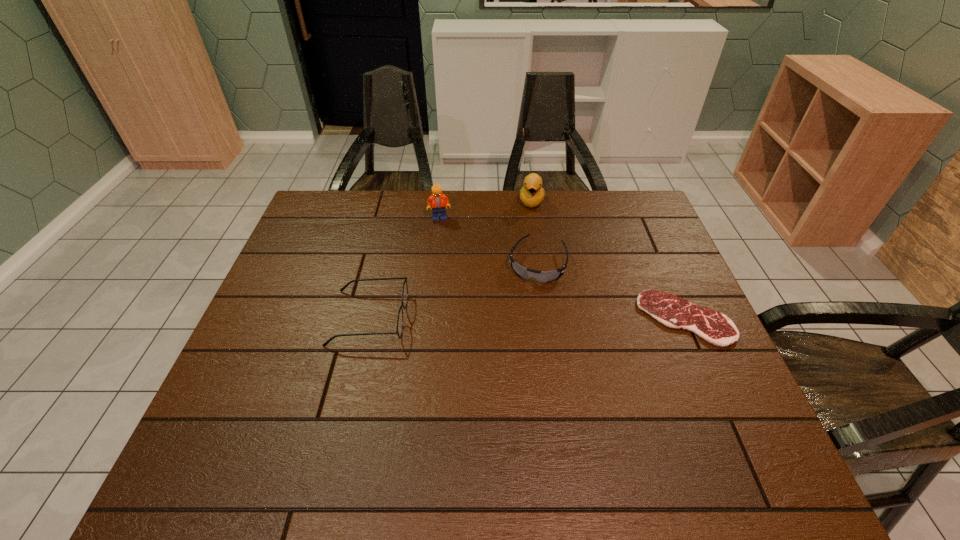
Where is `Lego that is at the far edge`? Lego that is at the far edge is located at coordinates (437, 201).

You are a GUI agent. You are given a task and a screenshot of the screen. Output one action in this format:
    pyautogui.click(x=<x>, y=<y>)
    Task: Click on the duckling located at the far edge
    Image resolution: width=960 pixels, height=540 pixels.
    Given the screenshot: What is the action you would take?
    pyautogui.click(x=532, y=194)

Find the location of a particular element. object that is at the right edge is located at coordinates (672, 311).

This screenshot has height=540, width=960. In the image, there is a desktop. Find the location of `free space at the far edge`. free space at the far edge is located at coordinates (492, 195).

In the image, there is a desktop. Where is `vacant area at the near edge`? The width and height of the screenshot is (960, 540). vacant area at the near edge is located at coordinates (357, 416).

In the image, there is a desktop. Where is `vacant region at the left edge`? The height and width of the screenshot is (540, 960). vacant region at the left edge is located at coordinates (283, 310).

Find the location of `vacant space at the far right corner`. vacant space at the far right corner is located at coordinates (602, 200).

Image resolution: width=960 pixels, height=540 pixels. In order to click on free spot between the shortest object and the sunglasses in this screenshot , I will do `click(611, 291)`.

Locate an element on the screen. Image resolution: width=960 pixels, height=540 pixels. vacant point located between the spectacles and the duckling is located at coordinates (450, 260).

Locate an element on the screen. vacant region between the farthest object and the rightmost object is located at coordinates (608, 260).